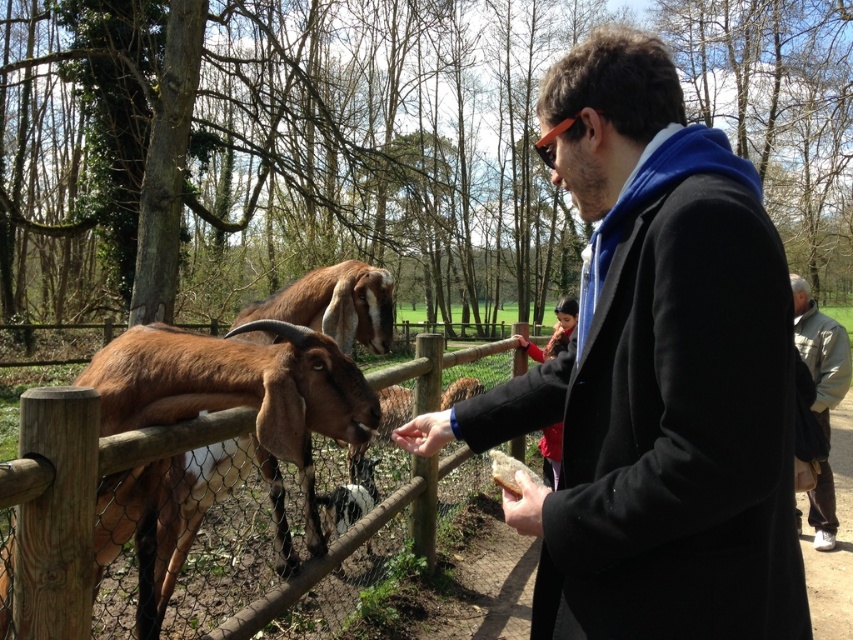
You are a zookeeper who needs to determine if a new fence panel, which is 1.2 meters wide, can fit between the light gray jacket at right and the smooth brown leather hand at lower center. Can it fit?

The light gray jacket at right might be wider than the smooth brown leather hand at lower center, so the distance between them is uncertain. Without knowing the exact width, it is not possible to confirm if the 1.2 meter fence panel will fit.

You are a zookeeper preparing to distribute feed to visitors. You have two jackets available for the staff. The black wool coat at center and the light gray jacket at right. Which jacket is more suitable for a staff member who needs to carry a large bag on their back?

The light gray jacket at right is more suitable because it has a larger size compared to the black wool coat at center, providing more space for carrying a large bag on the back.